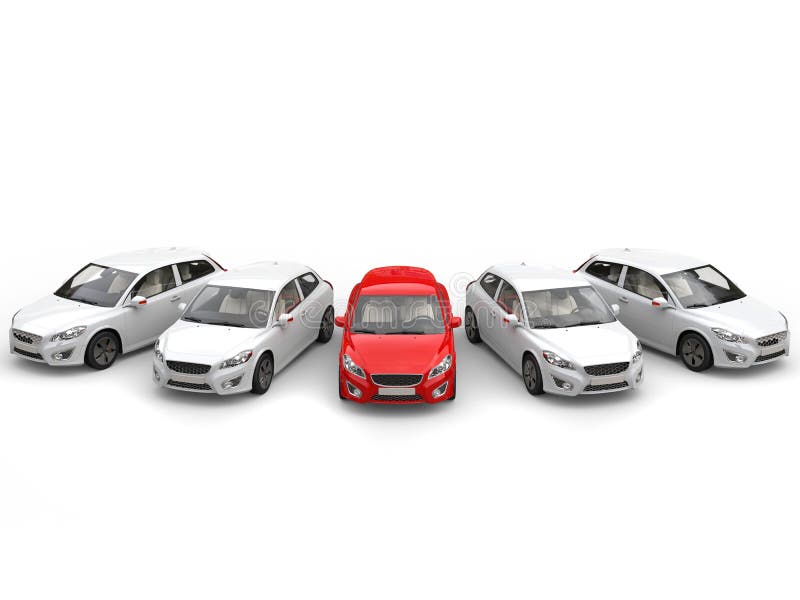
Locate an element on the screen. This screenshot has height=600, width=800. front door is located at coordinates (156, 300), (298, 328), (502, 325), (644, 307).